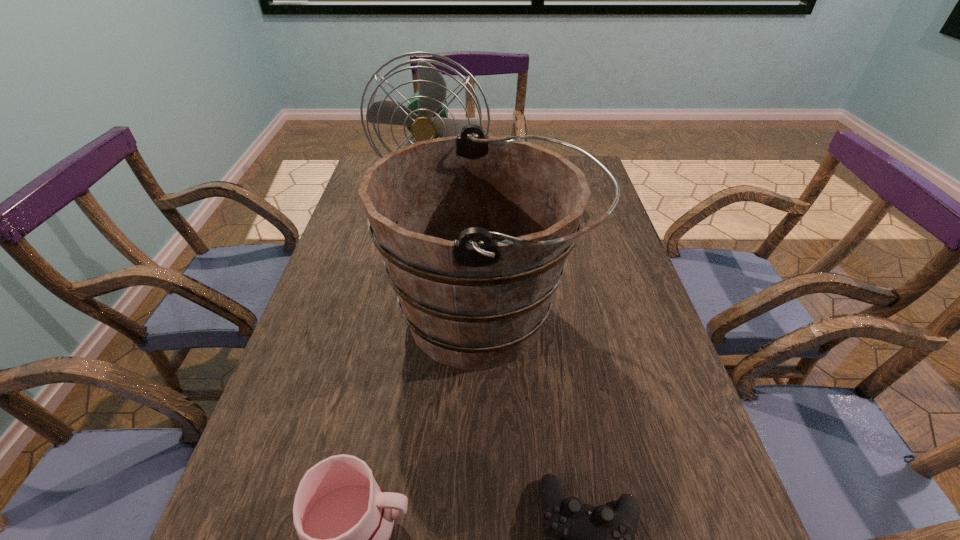
The width and height of the screenshot is (960, 540). In order to click on vacant space at the right edge of the desktop in this screenshot , I will do `click(643, 379)`.

This screenshot has width=960, height=540. Find the location of `vacant region at the far right corner of the desktop`. vacant region at the far right corner of the desktop is located at coordinates (595, 170).

I want to click on the second closest object relative to the second shortest object, so click(x=599, y=539).

Find the location of a particular element. This screenshot has width=960, height=540. object that is the closest to the second shortest object is located at coordinates (474, 230).